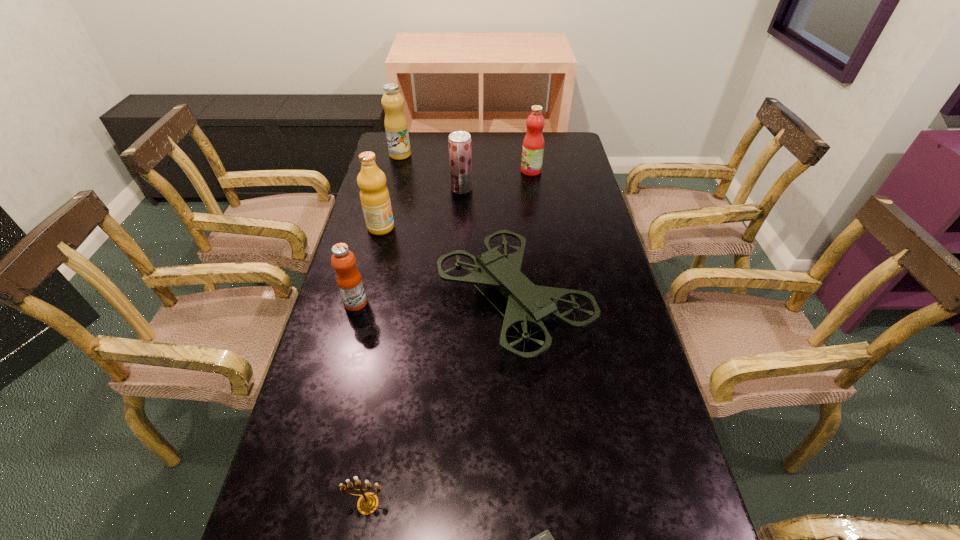
At what (x,y) coordinates should I click in order to perform the action: click on the farthest object. Please return your answer as a coordinate pair (x, y). The height and width of the screenshot is (540, 960). Looking at the image, I should click on (396, 127).

I want to click on the fourth farthest object, so click(374, 195).

This screenshot has width=960, height=540. Find the location of `the seventh nearest object`. the seventh nearest object is located at coordinates (533, 144).

This screenshot has height=540, width=960. Find the location of `the rightmost fruit juice`. the rightmost fruit juice is located at coordinates (533, 144).

Identify the location of drone. (527, 303).

You are a GUI agent. You are given a task and a screenshot of the screen. Output one action in this format:
    pyautogui.click(x=<x>, y=<y>)
    Task: Click on the third nearest fruit juice
    
    Given the screenshot: What is the action you would take?
    pyautogui.click(x=460, y=147)

Image resolution: width=960 pixels, height=540 pixels. Identify the location of the second fruit juice from right to left. (460, 147).

Image resolution: width=960 pixels, height=540 pixels. Identify the location of the nearest fruit juice. (348, 278).

Locate an element on the screen. the fifth object from right to left is located at coordinates (367, 504).

This screenshot has height=540, width=960. In order to click on candelabrum in this screenshot , I will do `click(367, 504)`.